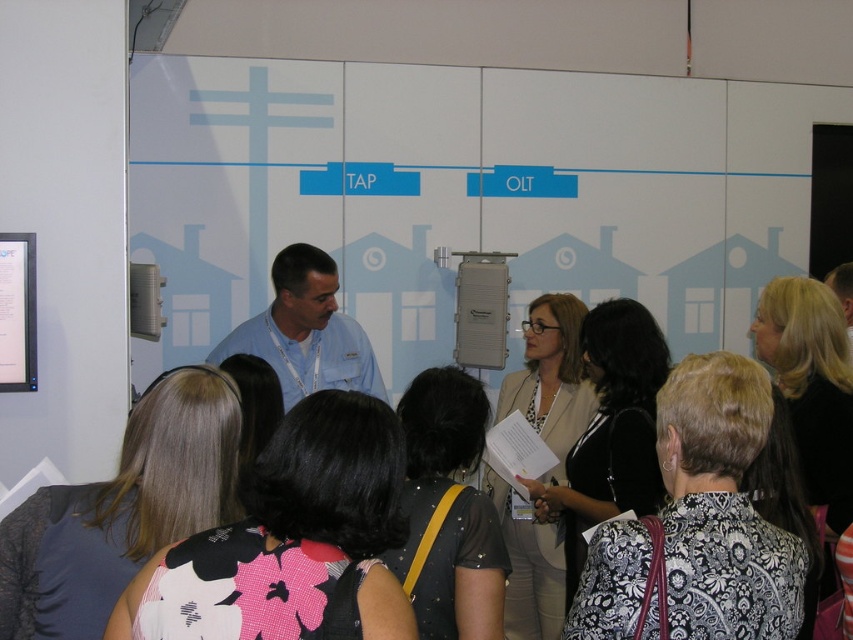
Does black floral dress at center have a smaller size compared to blue shirt at center?

Actually, black floral dress at center might be larger than blue shirt at center.

Does black floral dress at center appear on the right side of blue shirt at center?

Yes, black floral dress at center is to the right of blue shirt at center.

At what (x,y) coordinates should I click in order to perform the action: click on black floral dress at center. Please return your answer as a coordinate pair (x, y). The width and height of the screenshot is (853, 640). Looking at the image, I should click on (813, 378).

Locate an element on the screen. black floral dress at center is located at coordinates (813, 378).